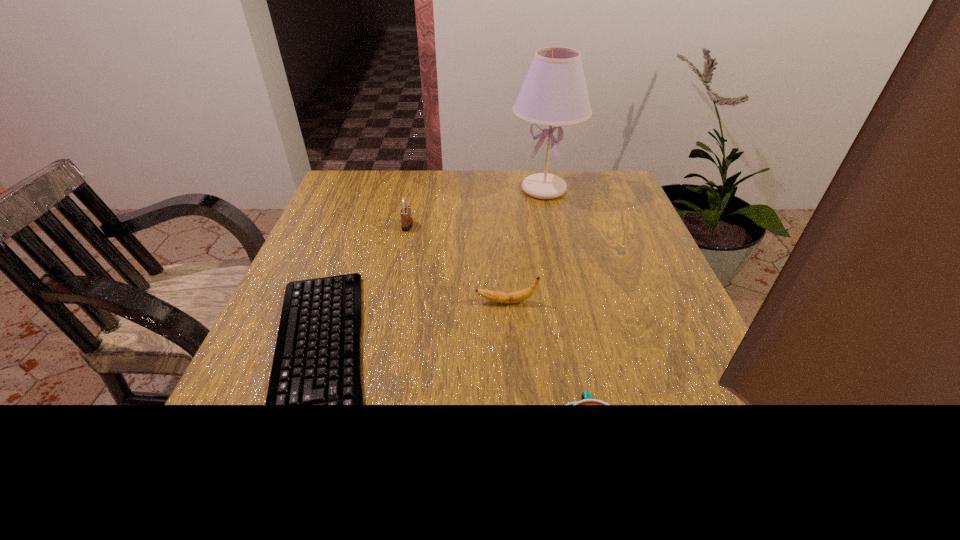
Find the location of a particular element. Image resolution: width=960 pixels, height=540 pixels. vacant space located 0.100m on the peel of the banana from the top is located at coordinates (426, 302).

Identify the location of vacant space located 0.130m on the peel of the banana from the top. (412, 302).

In order to click on blank space located 0.180m with the handle on the right side of the cappuccino in this screenshot , I will do tap(564, 326).

Identify the location of vacant space located 0.260m with the handle on the right side of the cappuccino. (559, 296).

Where is `vacant space located with the handle on the right side of the cappuccino`? This screenshot has height=540, width=960. vacant space located with the handle on the right side of the cappuccino is located at coordinates (573, 372).

Where is `vacant space located 0.340m on the back of the computer keyboard`? vacant space located 0.340m on the back of the computer keyboard is located at coordinates (377, 195).

Locate an element on the screen. object at the far edge is located at coordinates (554, 92).

Locate an element on the screen. This screenshot has width=960, height=540. cappuccino at the near edge is located at coordinates (586, 397).

I want to click on computer keyboard that is at the near edge, so click(x=317, y=360).

The image size is (960, 540). I want to click on object positioned at the left edge, so click(x=317, y=360).